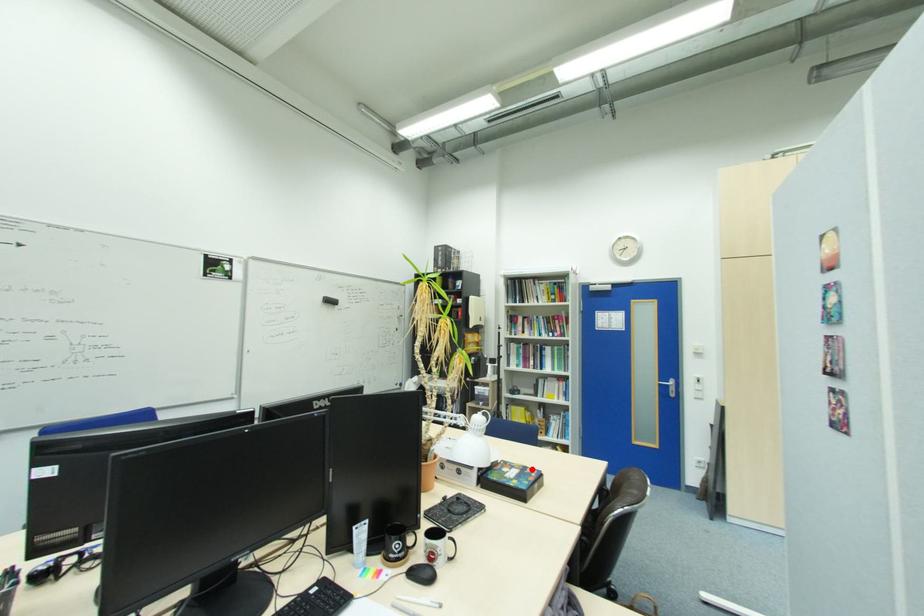
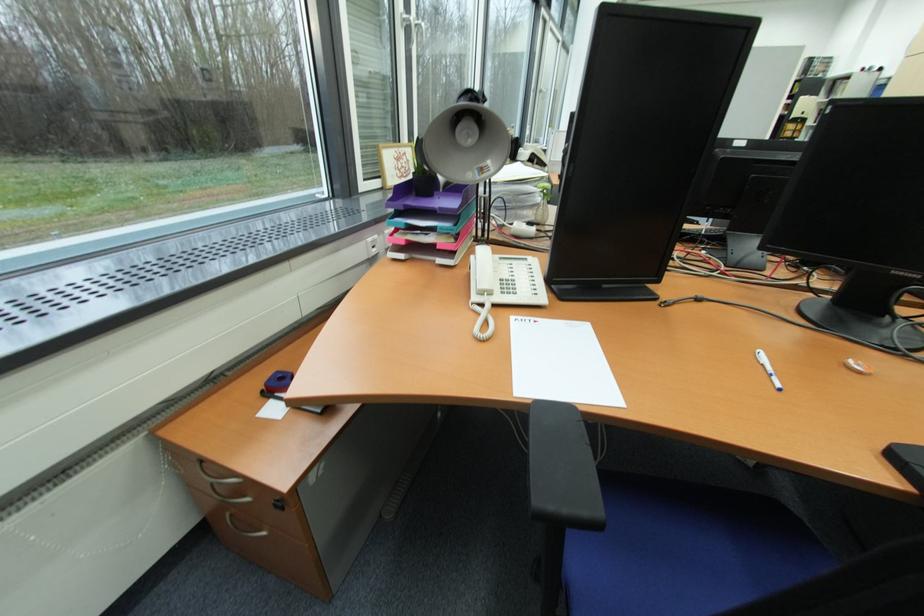
Question: I am providing you with two images of the same scene from different viewpoints. A red point is marked on the first image. Can you still see the location of the red point in image 2?

Choices:
 (A) Yes
 (B) No

Answer: (B)